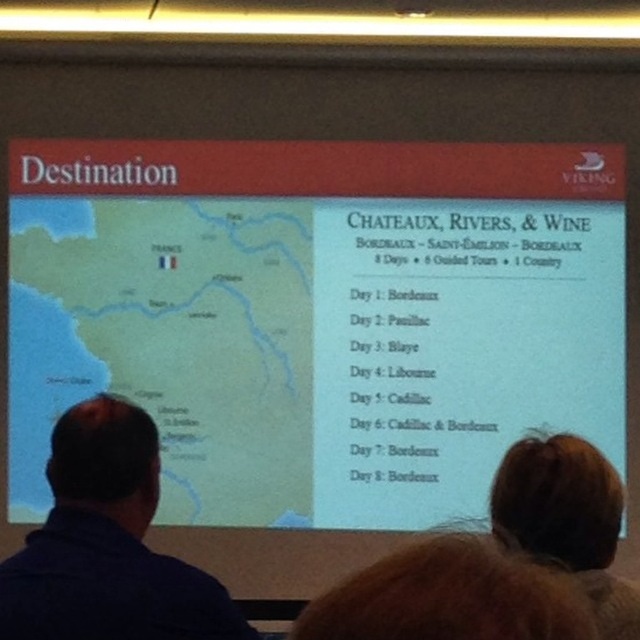
In the scene shown: You are standing behind two people observing a presentation slide about a trip to France. The slide has a map of Bordeaux and a list of activities. The blue shirt at left and brown hair at upper right are part of the audience. Which observer is closer to the screen?

The blue shirt at left is above brown hair at upper right, so the brown hair at upper right is closer to the screen because it is positioned lower and thus nearer to the observer.